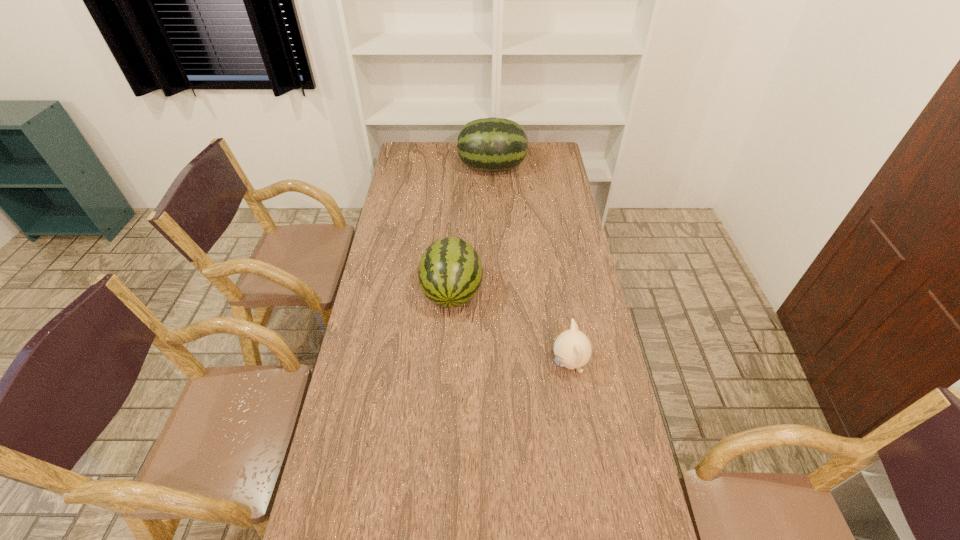
Where is `free space between the shortest object and the farthest object`? This screenshot has width=960, height=540. free space between the shortest object and the farthest object is located at coordinates (531, 266).

Where is `vacant space that is in between the shorter watermelon and the kitten`? The image size is (960, 540). vacant space that is in between the shorter watermelon and the kitten is located at coordinates (511, 328).

Where is `free space between the nearest object and the nearer watermelon`? This screenshot has height=540, width=960. free space between the nearest object and the nearer watermelon is located at coordinates point(511,328).

Image resolution: width=960 pixels, height=540 pixels. I want to click on empty space that is in between the nearest object and the second tallest object, so tap(511, 328).

At what (x,y) coordinates should I click in order to perform the action: click on free space between the farther watermelon and the shortest object. Please return your answer as a coordinate pair (x, y). The width and height of the screenshot is (960, 540). Looking at the image, I should click on (531, 266).

The height and width of the screenshot is (540, 960). I want to click on vacant space that's between the shorter watermelon and the shortest object, so click(x=511, y=328).

Point out which object is positioned as the nearest to the shortest object. Please provide its 2D coordinates. Your answer should be formatted as a tuple, i.e. [(x, y)], where the tuple contains the x and y coordinates of a point satisfying the conditions above.

[(450, 271)]

Where is `object that stands as the second closest to the farthest object`? object that stands as the second closest to the farthest object is located at coordinates (572, 348).